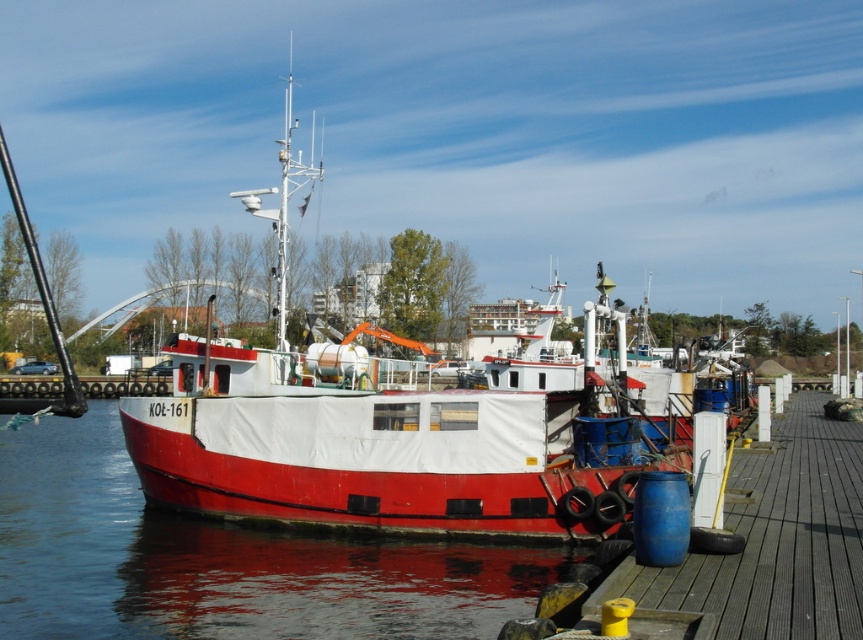
Can you confirm if red matte water at center is smaller than wooden dock at center?

Actually, red matte water at center might be larger than wooden dock at center.

Is red matte water at center positioned in front of wooden dock at center?

That is False.

Which is behind, point (33, 525) or point (772, 502)?

Point (33, 525)

In order to click on red matte water at center in this screenshot , I will do `click(221, 561)`.

Does red matte boat at center have a greater width compared to red matte water at center?

Yes, red matte boat at center is wider than red matte water at center.

Which is above, red matte boat at center or red matte water at center?

Positioned higher is red matte boat at center.

Where is `red matte boat at center`? red matte boat at center is located at coordinates (413, 435).

Is red matte boat at center bigger than wooden dock at center?

Yes, red matte boat at center is bigger than wooden dock at center.

Is point (392, 424) more distant than point (832, 586)?

Yes, point (392, 424) is farther from viewer.

Find the location of a particular element. red matte boat at center is located at coordinates (413, 435).